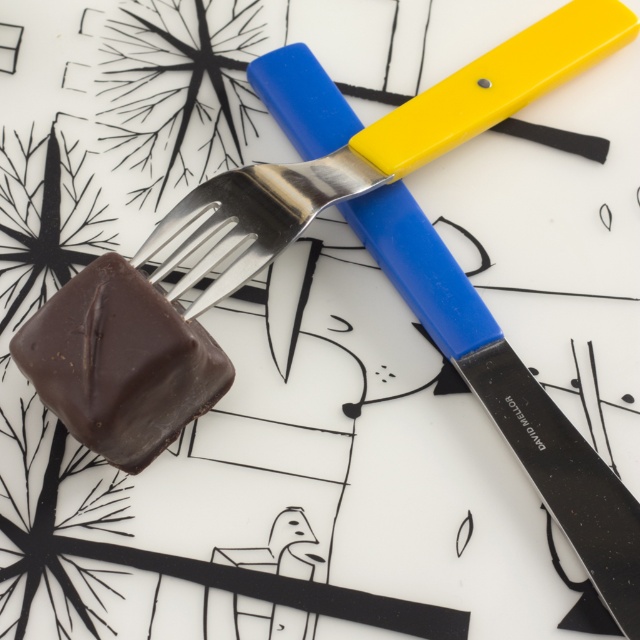
Question: Is shiny metal fork at lower left positioned in front of chocolatesmoothchocolate cube at left?

Choices:
 (A) yes
 (B) no

Answer: (B)

Question: Can you confirm if shiny metal fork at lower left is positioned above chocolatesmoothchocolate cube at left?

Choices:
 (A) yes
 (B) no

Answer: (A)

Question: Does shiny metal fork at lower left appear over chocolatesmoothchocolate cube at left?

Choices:
 (A) yes
 (B) no

Answer: (A)

Question: Which point appears farthest from the camera in this image?

Choices:
 (A) (88, 264)
 (B) (285, 212)

Answer: (B)

Question: Among these objects, which one is farthest from the camera?

Choices:
 (A) shiny metal fork at lower left
 (B) chocolatesmoothchocolate cube at left

Answer: (A)

Question: Among these points, which one is nearest to the camera?

Choices:
 (A) (611, 12)
 (B) (220, 364)

Answer: (B)